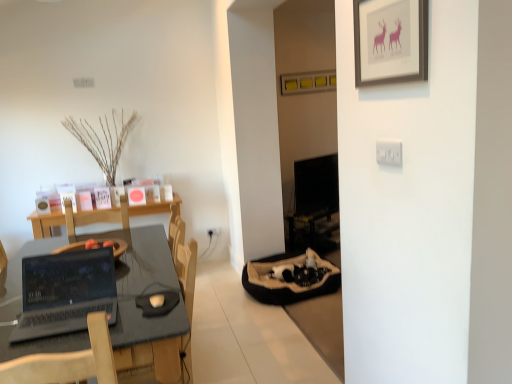
Question: Considering the relative sizes of silver metallic laptop at lower left and black glossy monitor at center in the image provided, is silver metallic laptop at lower left smaller than black glossy monitor at center?

Choices:
 (A) no
 (B) yes

Answer: (B)

Question: Is silver metallic laptop at lower left thinner than black glossy monitor at center?

Choices:
 (A) no
 (B) yes

Answer: (A)

Question: Considering the relative sizes of silver metallic laptop at lower left and black glossy monitor at center in the image provided, is silver metallic laptop at lower left taller than black glossy monitor at center?

Choices:
 (A) no
 (B) yes

Answer: (A)

Question: Can you confirm if silver metallic laptop at lower left is positioned to the left of black glossy monitor at center?

Choices:
 (A) no
 (B) yes

Answer: (B)

Question: Is silver metallic laptop at lower left facing away from black glossy monitor at center?

Choices:
 (A) no
 (B) yes

Answer: (A)

Question: Choose the correct answer: Is black glossy monitor at center inside white plastic light switch at upper right or outside it?

Choices:
 (A) inside
 (B) outside

Answer: (B)

Question: In terms of width, does black glossy monitor at center look wider or thinner when compared to white plastic light switch at upper right?

Choices:
 (A) wide
 (B) thin

Answer: (A)

Question: From the image's perspective, is black glossy monitor at center located above or below white plastic light switch at upper right?

Choices:
 (A) below
 (B) above

Answer: (A)

Question: Is black glossy monitor at center taller or shorter than white plastic light switch at upper right?

Choices:
 (A) tall
 (B) short

Answer: (A)

Question: Is white plastic light switch at upper right taller or shorter than black glossy monitor at center?

Choices:
 (A) short
 (B) tall

Answer: (A)

Question: Considering the positions of white plastic light switch at upper right and black glossy monitor at center in the image, is white plastic light switch at upper right bigger or smaller than black glossy monitor at center?

Choices:
 (A) small
 (B) big

Answer: (A)

Question: In the image, is white plastic light switch at upper right on the left side or the right side of black glossy monitor at center?

Choices:
 (A) left
 (B) right

Answer: (A)

Question: Is white plastic light switch at upper right spatially inside black glossy monitor at center, or outside of it?

Choices:
 (A) outside
 (B) inside

Answer: (A)

Question: Looking at the image, does matte black desk at left seem bigger or smaller compared to silver metallic laptop at lower left?

Choices:
 (A) small
 (B) big

Answer: (B)

Question: From a real-world perspective, is matte black desk at left physically located above or below silver metallic laptop at lower left?

Choices:
 (A) below
 (B) above

Answer: (A)